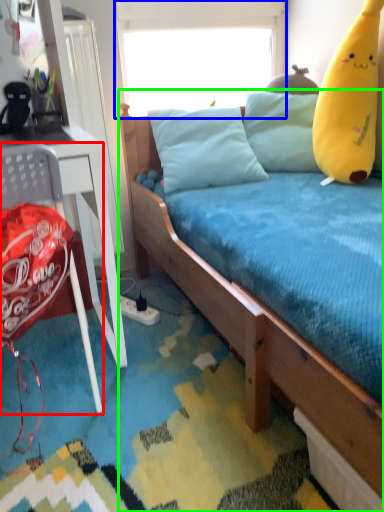
Question: Based on their relative distances, which object is nearer to chair (highlighted by a red box)? Choose from window screen (highlighted by a blue box) and bed (highlighted by a green box).

Choices:
 (A) window screen
 (B) bed

Answer: (B)